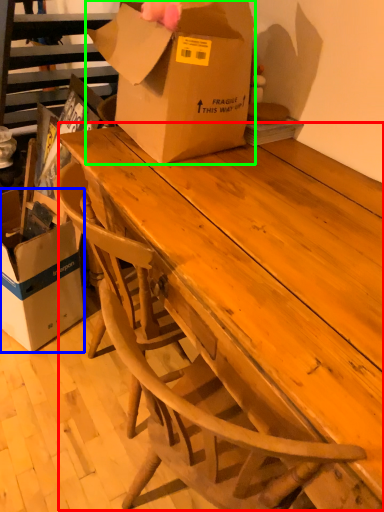
Question: Which is nearer to the table (highlighted by a red box)? box (highlighted by a blue box) or box (highlighted by a green box).

Choices:
 (A) box
 (B) box

Answer: (B)